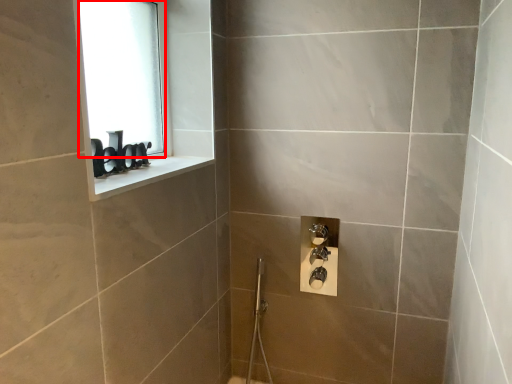
Question: In this image, where is window screen (annotated by the red box) located relative to window sill?

Choices:
 (A) left
 (B) right

Answer: (A)